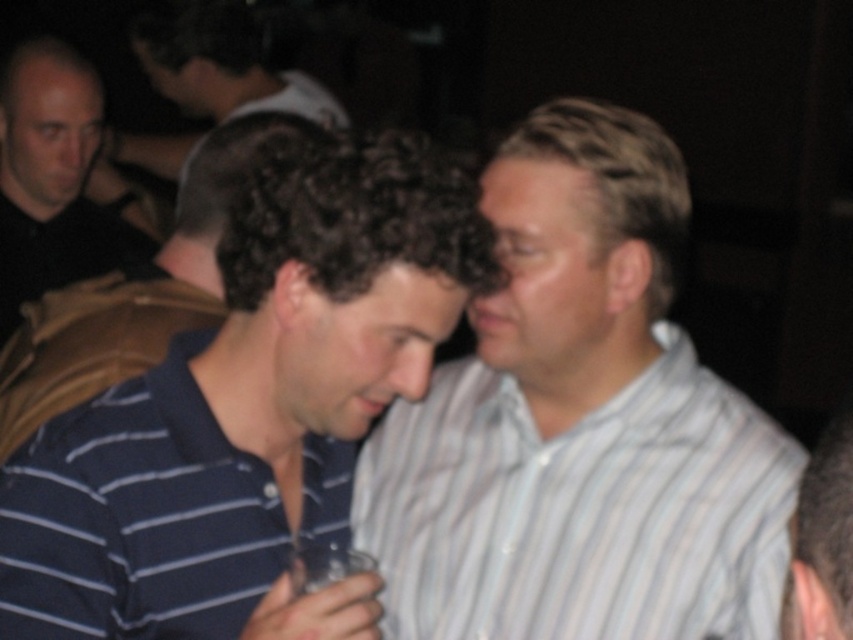
You are standing in the room and want to know which object is shorter between the black shirt at left and the dark brown hair at upper center. Can you determine this?

The black shirt at left has a lesser height compared to the dark brown hair at upper center, so the black shirt at left is shorter.

In the image of a social gathering, there are two men in the foreground. The man on the left is wearing a navy blue polo shirt with horizontal white stripes, and the man on the right is wearing a light gray striped shirt. Where is the white striped shirt at center located in relation to the other elements?

The white striped shirt at center is positioned at coordinates point (579, 424).